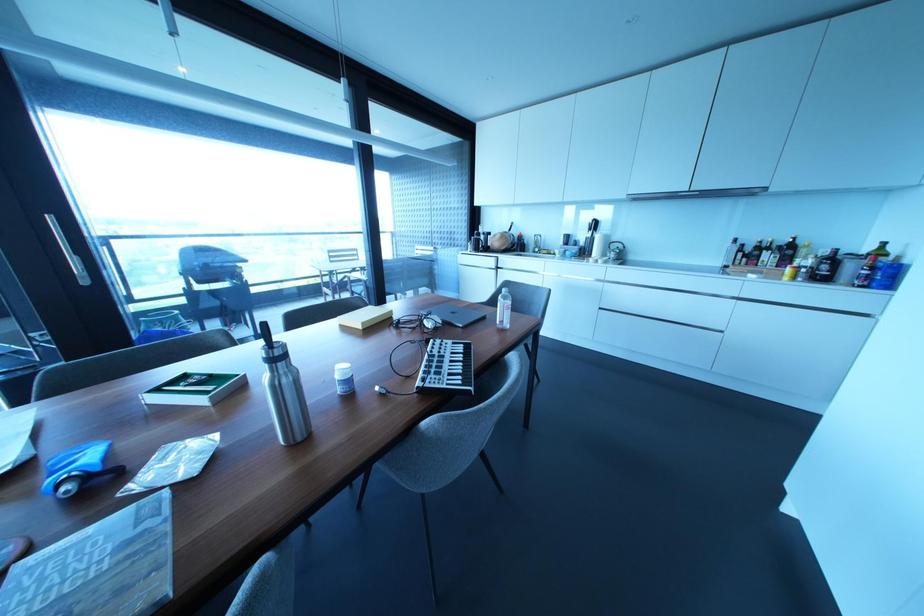
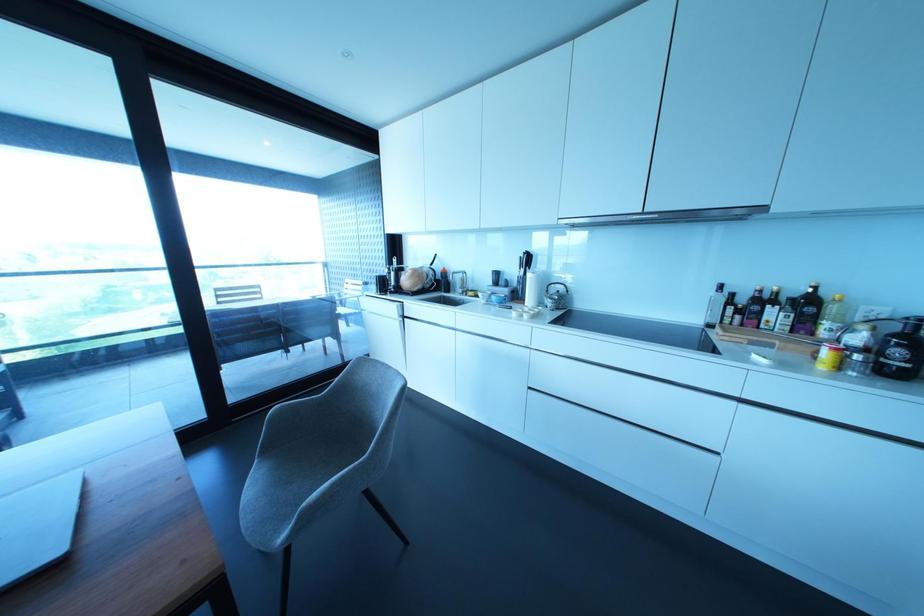
Where in the second image is the point corresponding to the point at 789,270 from the first image?

(825, 353)